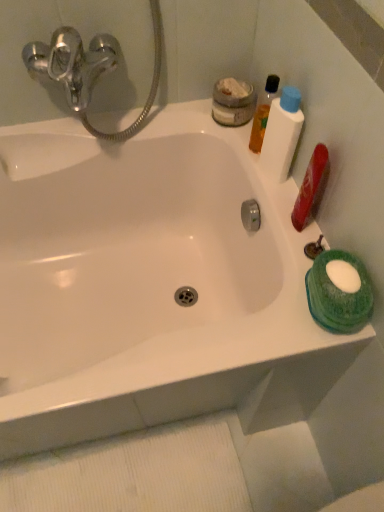
Find the location of a particular element. The height and width of the screenshot is (512, 384). free area in between green sponge at right, placed as the first mouthwash when sorted from bottom to top, and red matte bottle at right, placed as the fourth mouthwash when sorted from top to bottom is located at coordinates (298, 244).